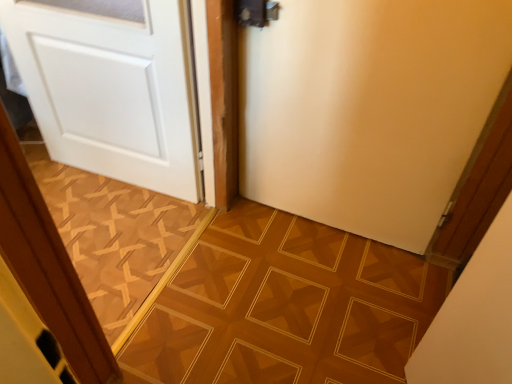
Question: Is brown textured tile at center, arranged as the first ceramic tile when viewed from the left, wider than white matte door at left, which is the first door in left-to-right order?

Choices:
 (A) yes
 (B) no

Answer: (A)

Question: From the image's perspective, is brown textured tile at center, positioned as the 2th ceramic tile in right-to-left order, under white matte door at left, which is the first door in left-to-right order?

Choices:
 (A) yes
 (B) no

Answer: (A)

Question: Is brown textured tile at center, arranged as the first ceramic tile when viewed from the left, not within white matte door at left, which is the first door in left-to-right order?

Choices:
 (A) no
 (B) yes

Answer: (B)

Question: Is white matte door at left, which is the 2th door in right-to-left order, inside brown textured tile at center, positioned as the 2th ceramic tile in right-to-left order?

Choices:
 (A) yes
 (B) no

Answer: (B)

Question: Is the depth of brown textured tile at center, positioned as the 2th ceramic tile in right-to-left order, greater than that of white matte door at left, which is the 2th door in right-to-left order?

Choices:
 (A) no
 (B) yes

Answer: (B)

Question: From the image's perspective, is brown textured tile at center, positioned as the 2th ceramic tile in right-to-left order, on top of white matte door at left, which is the first door in left-to-right order?

Choices:
 (A) no
 (B) yes

Answer: (A)

Question: Can you confirm if white matte door at center, arranged as the second door when viewed from the left, is bigger than brown textured tile at center, arranged as the first ceramic tile when viewed from the left?

Choices:
 (A) no
 (B) yes

Answer: (B)

Question: Does white matte door at center, arranged as the second door when viewed from the left, have a lesser width compared to brown textured tile at center, positioned as the 2th ceramic tile in right-to-left order?

Choices:
 (A) no
 (B) yes

Answer: (B)

Question: From a real-world perspective, is white matte door at center, arranged as the 1th door when viewed from the right, located higher than brown textured tile at center, arranged as the first ceramic tile when viewed from the left?

Choices:
 (A) yes
 (B) no

Answer: (A)

Question: From the image's perspective, is white matte door at center, arranged as the second door when viewed from the left, located beneath brown textured tile at center, arranged as the first ceramic tile when viewed from the left?

Choices:
 (A) yes
 (B) no

Answer: (B)

Question: Is white matte door at center, arranged as the second door when viewed from the left, facing towards brown textured tile at center, positioned as the 2th ceramic tile in right-to-left order?

Choices:
 (A) yes
 (B) no

Answer: (B)

Question: Is white matte door at center, arranged as the 1th door when viewed from the right, far away from brown textured tile at center, positioned as the 2th ceramic tile in right-to-left order?

Choices:
 (A) yes
 (B) no

Answer: (B)

Question: Considering the relative sizes of brown textured tile at center, arranged as the first ceramic tile when viewed from the left, and white matte door at center, arranged as the second door when viewed from the left, in the image provided, is brown textured tile at center, arranged as the first ceramic tile when viewed from the left, bigger than white matte door at center, arranged as the second door when viewed from the left,?

Choices:
 (A) yes
 (B) no

Answer: (B)